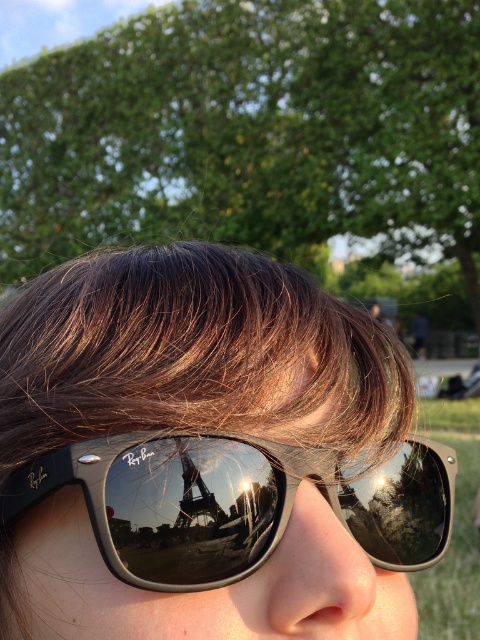
Question: Which object is closer to the camera taking this photo?

Choices:
 (A) black reflective sunglasses at center
 (B) glossy metallic eiffel tower at center

Answer: (A)

Question: Can you confirm if black matte sunglasses at center is positioned below black reflective sunglasses at center?

Choices:
 (A) yes
 (B) no

Answer: (B)

Question: Among these points, which one is farthest from the camera?

Choices:
 (A) (219, 513)
 (B) (190, 458)
 (C) (149, 278)

Answer: (C)

Question: Considering the real-world distances, which object is closest to the black matte sunglasses at center?

Choices:
 (A) glossy metallic eiffel tower at center
 (B) black reflective sunglasses at center

Answer: (B)

Question: Is black matte sunglasses at center smaller than black reflective sunglasses at center?

Choices:
 (A) no
 (B) yes

Answer: (A)

Question: Can you confirm if black matte sunglasses at center is wider than black reflective sunglasses at center?

Choices:
 (A) no
 (B) yes

Answer: (B)